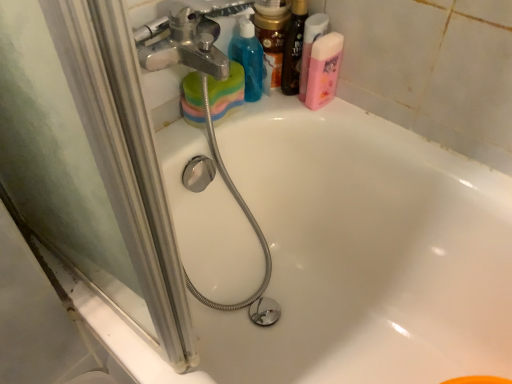
Locate an element on the screen. Image resolution: width=512 pixels, height=384 pixels. free spot in front of shiny black bottle at upper right, which is the second toiletry in left-to-right order is located at coordinates (294, 115).